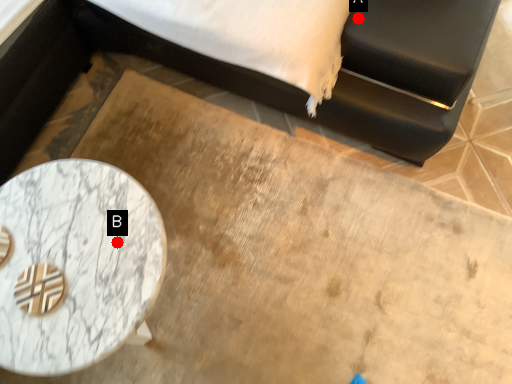
Question: Two points are circled on the image, labeled by A and B beside each circle. Which point is closer to the camera?

Choices:
 (A) A is closer
 (B) B is closer

Answer: (B)